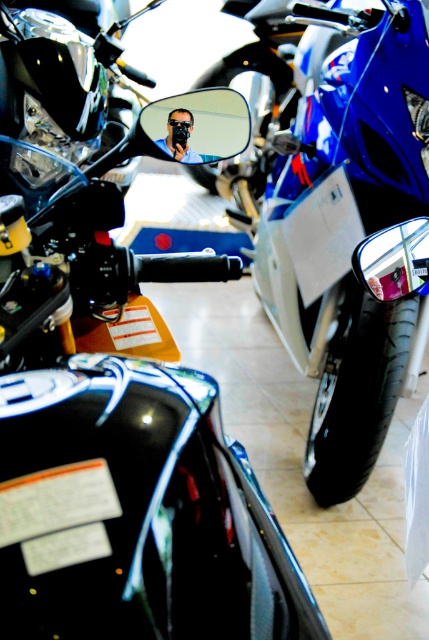
Question: Can you confirm if blue glossy motorcycle at center is wider than matte black face mask at center?

Choices:
 (A) no
 (B) yes

Answer: (B)

Question: Which point is farther to the camera?

Choices:
 (A) blue glossy motorcycle at center
 (B) matte black face mask at center

Answer: (A)

Question: Is blue glossy motorcycle at center positioned at the back of matte black face mask at center?

Choices:
 (A) no
 (B) yes

Answer: (B)

Question: Does blue glossy motorcycle at center have a smaller size compared to matte black face mask at center?

Choices:
 (A) no
 (B) yes

Answer: (A)

Question: Which of the following is the farthest from the observer?

Choices:
 (A) matte black face mask at center
 (B) blue glossy motorcycle at center

Answer: (B)